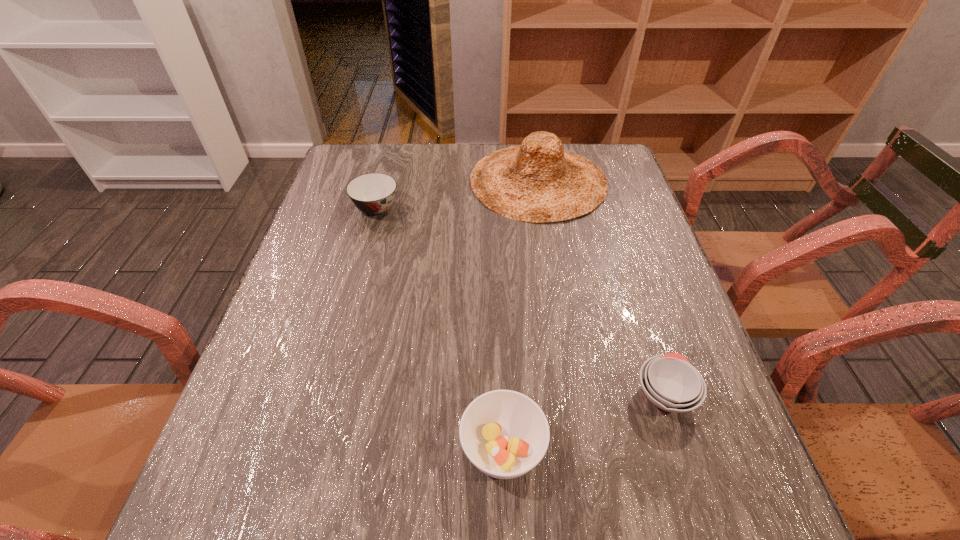
Find the location of a particular element. This screenshot has height=540, width=960. object at the far edge is located at coordinates (537, 181).

This screenshot has height=540, width=960. I want to click on object that is at the near edge, so click(505, 434).

Locate an element on the screen. This screenshot has width=960, height=540. object present at the left edge is located at coordinates click(x=373, y=193).

At what (x,y) coordinates should I click in order to perform the action: click on sunhat at the right edge. Please return your answer as a coordinate pair (x, y). Looking at the image, I should click on [537, 181].

Where is `soup bowl that is positioned at the right edge`? soup bowl that is positioned at the right edge is located at coordinates (670, 382).

I want to click on object at the far right corner, so pos(537,181).

You are a GUI agent. You are given a task and a screenshot of the screen. Output one action in this format:
    pyautogui.click(x=<x>, y=<y>)
    Task: Click on the vacant space at the far edge of the desktop
    
    Given the screenshot: What is the action you would take?
    pyautogui.click(x=411, y=151)

Where is `free space at the near edge`? The width and height of the screenshot is (960, 540). free space at the near edge is located at coordinates (357, 491).

Find the location of a particular element. The height and width of the screenshot is (540, 960). vacant space at the left edge is located at coordinates (341, 186).

Where is `free space at the right edge of the desktop`? The image size is (960, 540). free space at the right edge of the desktop is located at coordinates (619, 248).